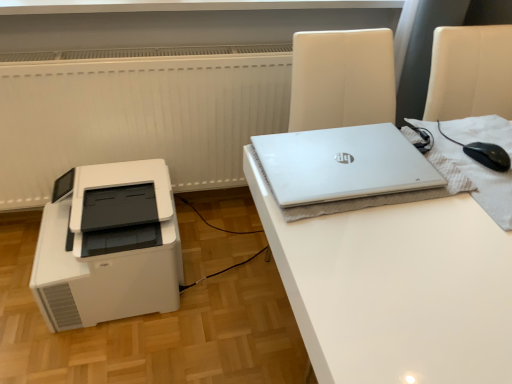
Question: From the image's perspective, is silver metallic laptop at upper right under white plastic printer at lower left?

Choices:
 (A) yes
 (B) no

Answer: (B)

Question: Does silver metallic laptop at upper right have a larger size compared to white plastic printer at lower left?

Choices:
 (A) yes
 (B) no

Answer: (B)

Question: Could you tell me if silver metallic laptop at upper right is facing white plastic printer at lower left?

Choices:
 (A) yes
 (B) no

Answer: (B)

Question: Is silver metallic laptop at upper right behind white plastic printer at lower left?

Choices:
 (A) no
 (B) yes

Answer: (A)

Question: Does silver metallic laptop at upper right have a smaller size compared to white plastic printer at lower left?

Choices:
 (A) yes
 (B) no

Answer: (A)

Question: Does point pyautogui.click(x=423, y=251) appear closer or farther from the camera than point pyautogui.click(x=167, y=200)?

Choices:
 (A) farther
 (B) closer

Answer: (B)

Question: Is white glossy desk at upper right wider or thinner than white plastic printer at lower left?

Choices:
 (A) thin
 (B) wide

Answer: (B)

Question: Considering their positions, is white glossy desk at upper right located in front of or behind white plastic printer at lower left?

Choices:
 (A) front
 (B) behind

Answer: (A)

Question: In the image, is white glossy desk at upper right on the left side or the right side of white plastic printer at lower left?

Choices:
 (A) right
 (B) left

Answer: (A)

Question: Considering their positions, is white glossy desk at upper right located in front of or behind black matte mouse at right?

Choices:
 (A) front
 (B) behind

Answer: (A)

Question: Considering the positions of white glossy desk at upper right and black matte mouse at right in the image, is white glossy desk at upper right bigger or smaller than black matte mouse at right?

Choices:
 (A) big
 (B) small

Answer: (A)

Question: Considering the positions of white glossy desk at upper right and black matte mouse at right in the image, is white glossy desk at upper right taller or shorter than black matte mouse at right?

Choices:
 (A) short
 (B) tall

Answer: (B)

Question: From the image's perspective, is white glossy desk at upper right above or below black matte mouse at right?

Choices:
 (A) above
 (B) below

Answer: (B)

Question: Is white plastic printer at lower left in front of or behind silver metallic laptop at upper right in the image?

Choices:
 (A) behind
 (B) front

Answer: (A)

Question: Is white plastic printer at lower left wider or thinner than silver metallic laptop at upper right?

Choices:
 (A) thin
 (B) wide

Answer: (B)